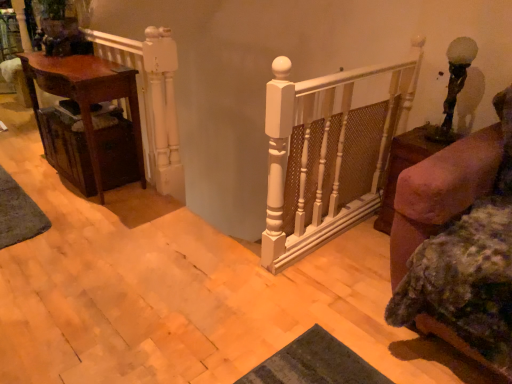
Question: Is woven brown drawer at left inside brown wooden side table at right?

Choices:
 (A) yes
 (B) no

Answer: (B)

Question: From the image's perspective, is brown wooden side table at right located beneath woven brown drawer at left?

Choices:
 (A) yes
 (B) no

Answer: (A)

Question: From the image's perspective, is brown wooden side table at right on top of woven brown drawer at left?

Choices:
 (A) no
 (B) yes

Answer: (A)

Question: Is the depth of brown wooden side table at right greater than that of woven brown drawer at left?

Choices:
 (A) yes
 (B) no

Answer: (B)

Question: Could you tell me if brown wooden side table at right is turned towards woven brown drawer at left?

Choices:
 (A) yes
 (B) no

Answer: (B)

Question: Based on their sizes in the image, would you say green textured mat at lower left is bigger or smaller than white painted wood railing at upper left?

Choices:
 (A) small
 (B) big

Answer: (A)

Question: From a real-world perspective, is green textured mat at lower left positioned above or below white painted wood railing at upper left?

Choices:
 (A) above
 (B) below

Answer: (B)

Question: Considering their positions, is green textured mat at lower left located in front of or behind white painted wood railing at upper left?

Choices:
 (A) behind
 (B) front

Answer: (A)

Question: Visually, is green textured mat at lower left positioned to the left or to the right of white painted wood railing at upper left?

Choices:
 (A) right
 (B) left

Answer: (B)

Question: Would you say brown wooden side table at right is to the left or to the right of white painted wood railing at upper left in the picture?

Choices:
 (A) right
 (B) left

Answer: (A)

Question: Do you think brown wooden side table at right is within white painted wood railing at upper left, or outside of it?

Choices:
 (A) inside
 (B) outside

Answer: (B)

Question: Considering the positions of brown wooden side table at right and white painted wood railing at upper left in the image, is brown wooden side table at right bigger or smaller than white painted wood railing at upper left?

Choices:
 (A) small
 (B) big

Answer: (B)

Question: From a real-world perspective, is brown wooden side table at right physically located above or below white painted wood railing at upper left?

Choices:
 (A) below
 (B) above

Answer: (A)

Question: From their relative heights in the image, would you say white painted wood railing at upper left is taller or shorter than matte brown table at left?

Choices:
 (A) short
 (B) tall

Answer: (B)

Question: Is white painted wood railing at upper left bigger or smaller than matte brown table at left?

Choices:
 (A) big
 (B) small

Answer: (B)